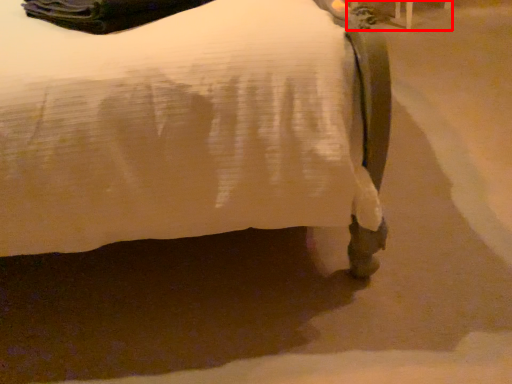
Question: Observing the image, what is the correct spatial positioning of furniture (annotated by the red box) in reference to bed?

Choices:
 (A) left
 (B) right

Answer: (B)